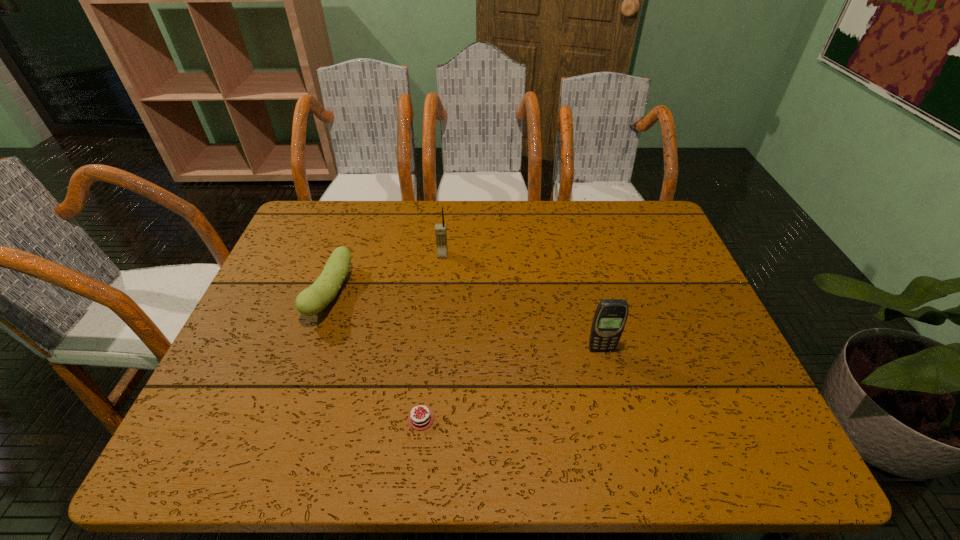
Where is `blank region between the left cellular telephone and the second nearest object`? The width and height of the screenshot is (960, 540). blank region between the left cellular telephone and the second nearest object is located at coordinates (522, 302).

Identify the location of vacant point located between the farther cellular telephone and the shortest object. (432, 336).

Identify the location of free space between the farthest object and the second nearest object. (522, 302).

This screenshot has width=960, height=540. Identify the location of vacant area that lies between the cucumber and the shortest object. (375, 356).

What are the coordinates of `vacant area that lies between the second shortest object and the nearer cellular telephone` in the screenshot? It's located at coord(466,322).

Locate an element on the screen. free space between the cucumber and the shortest object is located at coordinates (375, 356).

Find the location of a particular element. free spot between the third farthest object and the chocolate cake is located at coordinates (511, 384).

At what (x,y) coordinates should I click in order to perform the action: click on vacant area that lies between the right cellular telephone and the cucumber. Please return your answer as a coordinate pair (x, y). The height and width of the screenshot is (540, 960). Looking at the image, I should click on pos(466,322).

Where is `free spot between the shortest object and the second farthest object`? The image size is (960, 540). free spot between the shortest object and the second farthest object is located at coordinates click(375, 356).

Choose which object is the third nearest neighbor to the nearer cellular telephone. Please provide its 2D coordinates. Your answer should be formatted as a tuple, i.e. [(x, y)], where the tuple contains the x and y coordinates of a point satisfying the conditions above.

[(312, 300)]